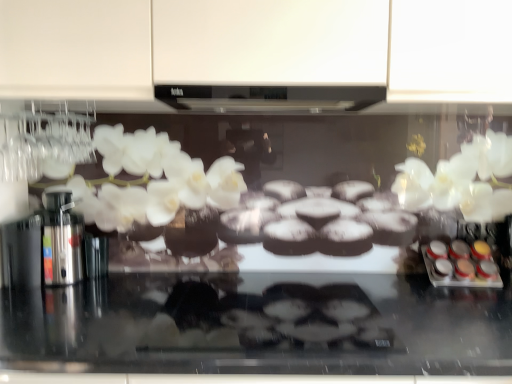
Question: Does metallic silver spice containers at right lie in front of black matte exhaust hood at center?

Choices:
 (A) no
 (B) yes

Answer: (A)

Question: Is metallic silver spice containers at right shorter than black matte exhaust hood at center?

Choices:
 (A) no
 (B) yes

Answer: (A)

Question: Is metallic silver spice containers at right thinner than black matte exhaust hood at center?

Choices:
 (A) no
 (B) yes

Answer: (B)

Question: Considering the relative positions of metallic silver spice containers at right and black matte exhaust hood at center in the image provided, is metallic silver spice containers at right to the right of black matte exhaust hood at center from the viewer's perspective?

Choices:
 (A) yes
 (B) no

Answer: (A)

Question: Can you confirm if metallic silver spice containers at right is bigger than black matte exhaust hood at center?

Choices:
 (A) yes
 (B) no

Answer: (B)

Question: Is metallic silver spice containers at right outside black matte exhaust hood at center?

Choices:
 (A) no
 (B) yes

Answer: (B)

Question: Can you confirm if black matte exhaust hood at center is positioned to the left of metallic silver spice containers at right?

Choices:
 (A) no
 (B) yes

Answer: (B)

Question: Can you confirm if black matte exhaust hood at center is smaller than metallic silver spice containers at right?

Choices:
 (A) no
 (B) yes

Answer: (A)

Question: Is black matte exhaust hood at center positioned beyond the bounds of metallic silver spice containers at right?

Choices:
 (A) no
 (B) yes

Answer: (B)

Question: Is black matte exhaust hood at center not near metallic silver spice containers at right?

Choices:
 (A) no
 (B) yes

Answer: (A)

Question: Considering the relative sizes of black matte exhaust hood at center and metallic silver spice containers at right in the image provided, is black matte exhaust hood at center bigger than metallic silver spice containers at right?

Choices:
 (A) no
 (B) yes

Answer: (B)

Question: From the image's perspective, is black matte exhaust hood at center under metallic silver spice containers at right?

Choices:
 (A) no
 (B) yes

Answer: (A)

Question: Considering the positions of metallic silver spice containers at right and black matte exhaust hood at center in the image, is metallic silver spice containers at right wider or thinner than black matte exhaust hood at center?

Choices:
 (A) wide
 (B) thin

Answer: (B)